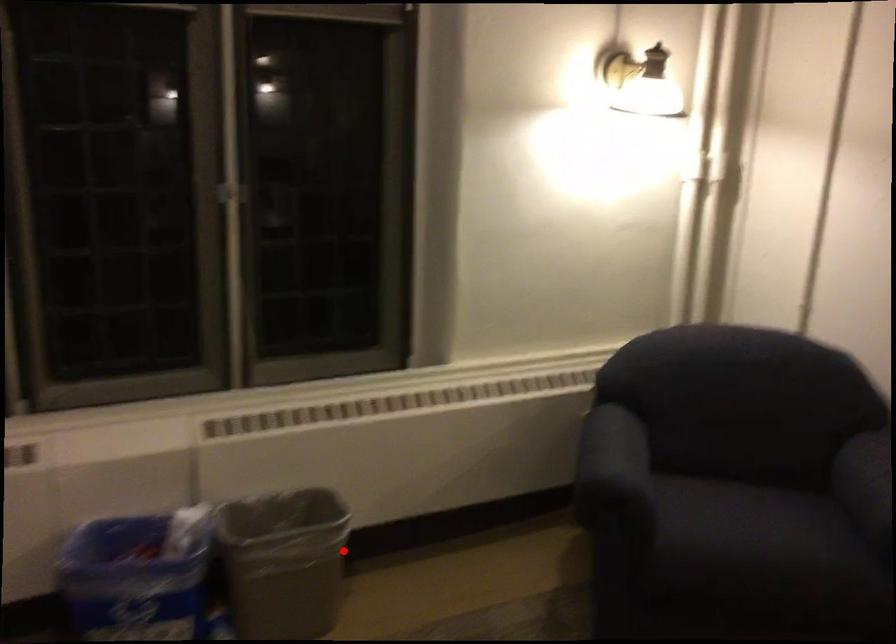
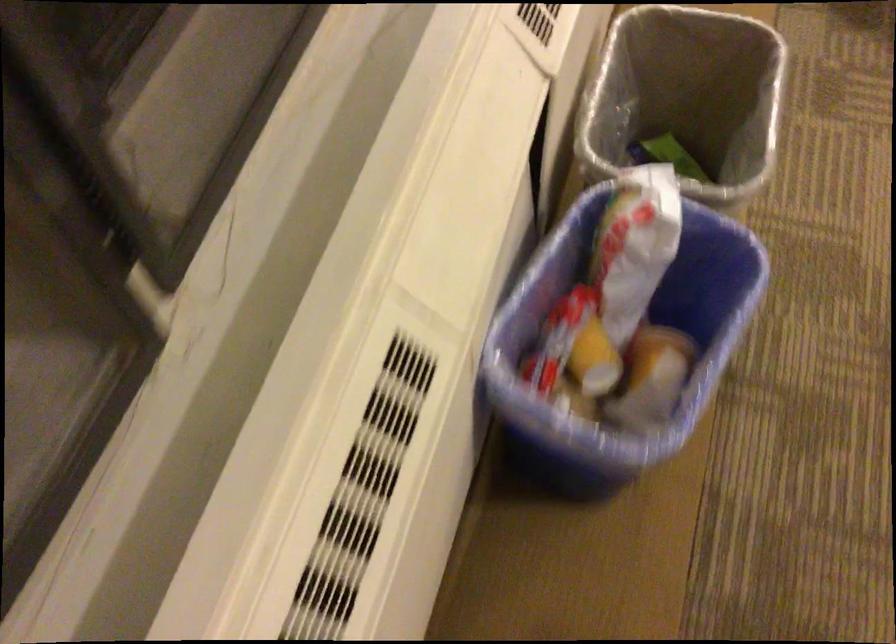
Locate, in the second image, the point that corresponds to the highlighted location in the first image.

(686, 97)